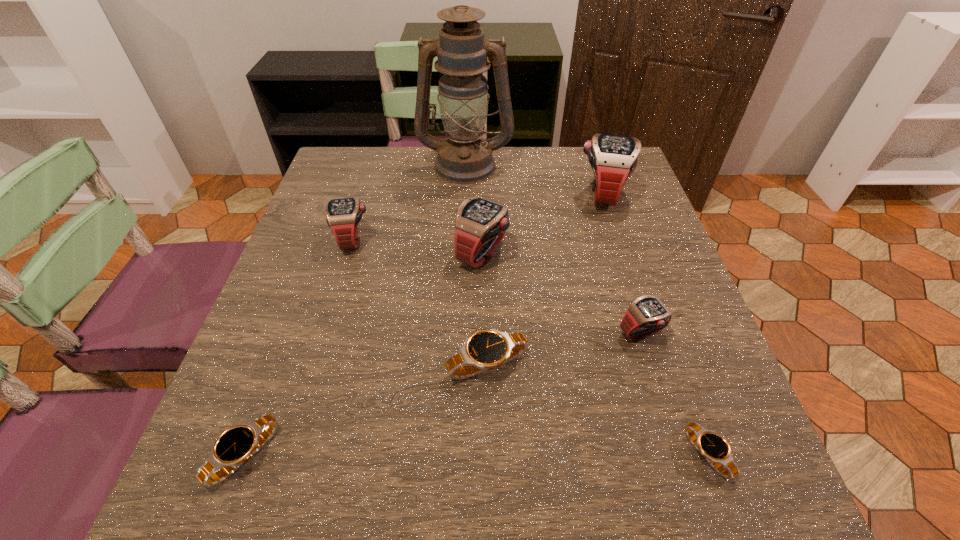
The height and width of the screenshot is (540, 960). Find the location of `vacant area in the image that satisfies the following two spatial constraints: 1. on the front side of the fourth tallest watch; 2. on the left side of the smallest black watch`. vacant area in the image that satisfies the following two spatial constraints: 1. on the front side of the fourth tallest watch; 2. on the left side of the smallest black watch is located at coordinates (680, 455).

Locate an element on the screen. The image size is (960, 540). vacant area that satisfies the following two spatial constraints: 1. on the front side of the shortest object; 2. on the left side of the second tallest watch is located at coordinates click(483, 455).